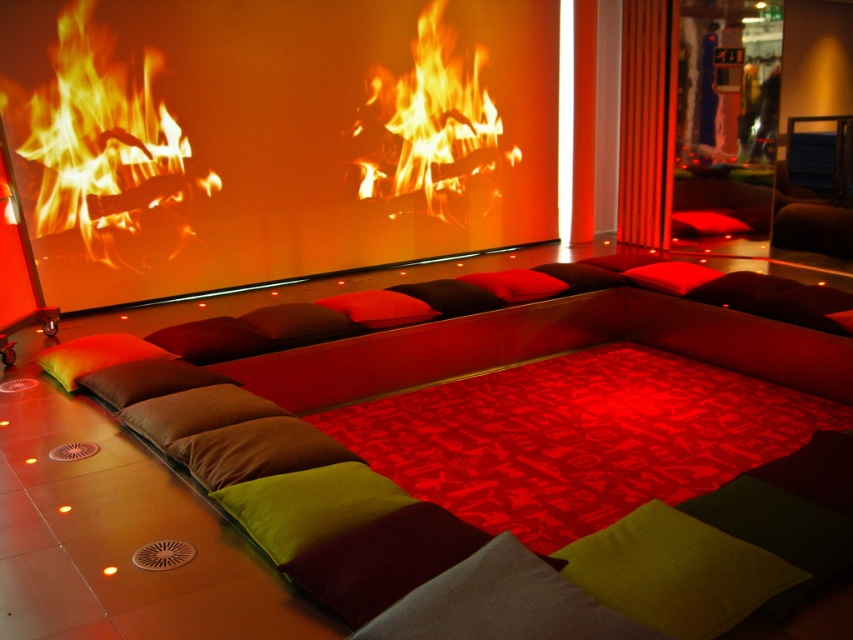
You are arranging a cozy seating area and want to place both the red matte pillow at center and the velvet red pillow at center on the seating arrangement. Which pillow should you place first if you want to ensure there is enough space for both?

The red matte pillow at center is bigger than the velvet red pillow at center, so you should place the red matte pillow at center first to ensure there is enough space for both.

You are standing in the seating area and want to place a small decorative item on the floor. The floor at point (273, 136) is occupied by the orange matte fireplace at center. Can you place the item there?

A: The floor at point (273, 136) is occupied by the orange matte fireplace at center, so you cannot place the item there.